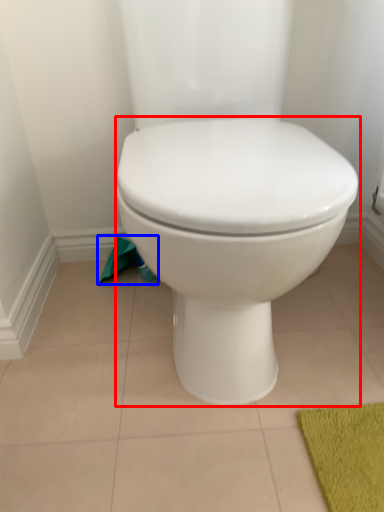
Question: Which object appears farthest to the camera in this image, toilet (highlighted by a red box) or toilet paper (highlighted by a blue box)?

Choices:
 (A) toilet
 (B) toilet paper

Answer: (B)